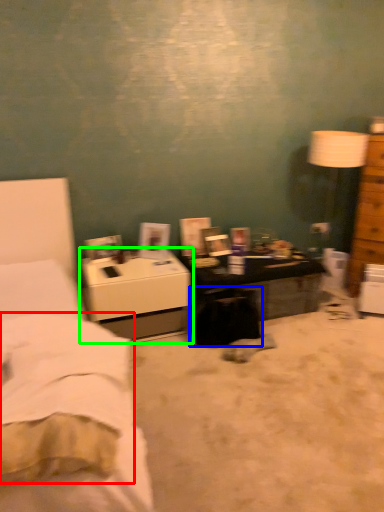
Question: Estimate the real-world distances between objects in this image. Which object is closer to sheet (highlighted by a red box), swivel chair (highlighted by a blue box) or nightstand (highlighted by a green box)?

Choices:
 (A) swivel chair
 (B) nightstand

Answer: (B)